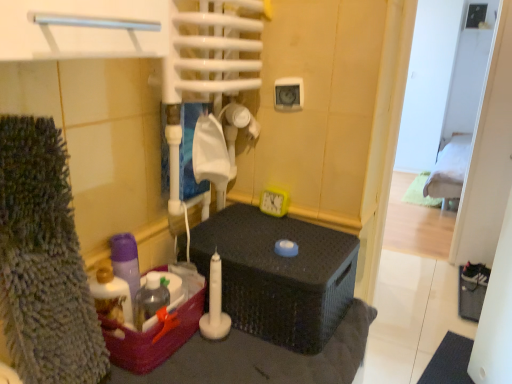
Question: From the image's perspective, relative to green fabric bed at upper right, is translucent plastic bottle at lower left above or below?

Choices:
 (A) above
 (B) below

Answer: (B)

Question: Considering the positions of translucent plastic bottle at lower left and green fabric bed at upper right in the image, is translucent plastic bottle at lower left wider or thinner than green fabric bed at upper right?

Choices:
 (A) thin
 (B) wide

Answer: (A)

Question: Which object is positioned farthest from the translucent plastic bottle at lower left?

Choices:
 (A) translucent plastic basket at lower left
 (B) green fabric bed at upper right
 (C) matte black wicker basket at center

Answer: (B)

Question: Considering the real-world distances, which object is farthest from the translucent plastic basket at lower left?

Choices:
 (A) translucent plastic bottle at lower left
 (B) green fabric bed at upper right
 (C) matte black wicker basket at center

Answer: (B)